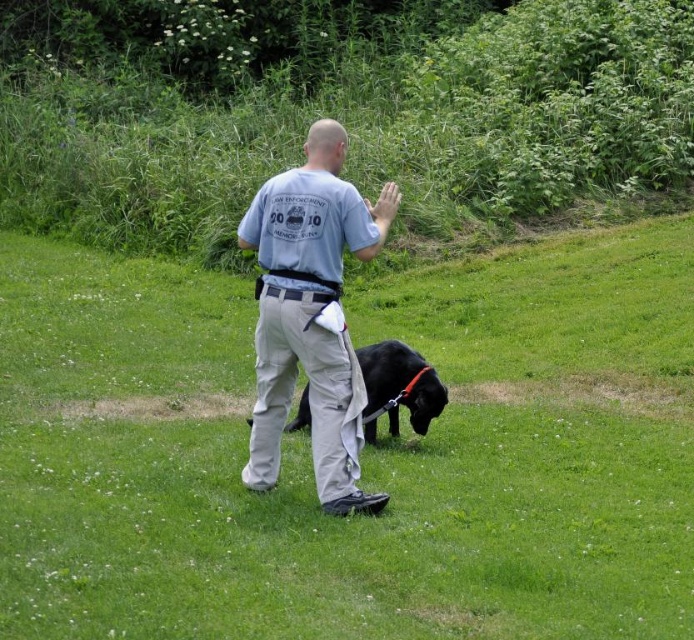
Question: Can you confirm if green grass at center is positioned above black matte dog at center?

Choices:
 (A) no
 (B) yes

Answer: (B)

Question: Which object is the closest to the green grass at center?

Choices:
 (A) black matte dog at center
 (B) gray cotton shirt at center
 (C) black leather belt at center

Answer: (A)

Question: Which point is farther to the camera?

Choices:
 (A) (323, 291)
 (B) (448, 560)

Answer: (A)

Question: Can you confirm if green grass at center is bigger than black matte dog at center?

Choices:
 (A) yes
 (B) no

Answer: (A)

Question: Which point is farther to the camera?

Choices:
 (A) green grass at center
 (B) gray cotton shirt at center
 (C) black leather belt at center

Answer: (C)

Question: Is the position of gray cotton shirt at center less distant than that of black leather belt at center?

Choices:
 (A) yes
 (B) no

Answer: (A)